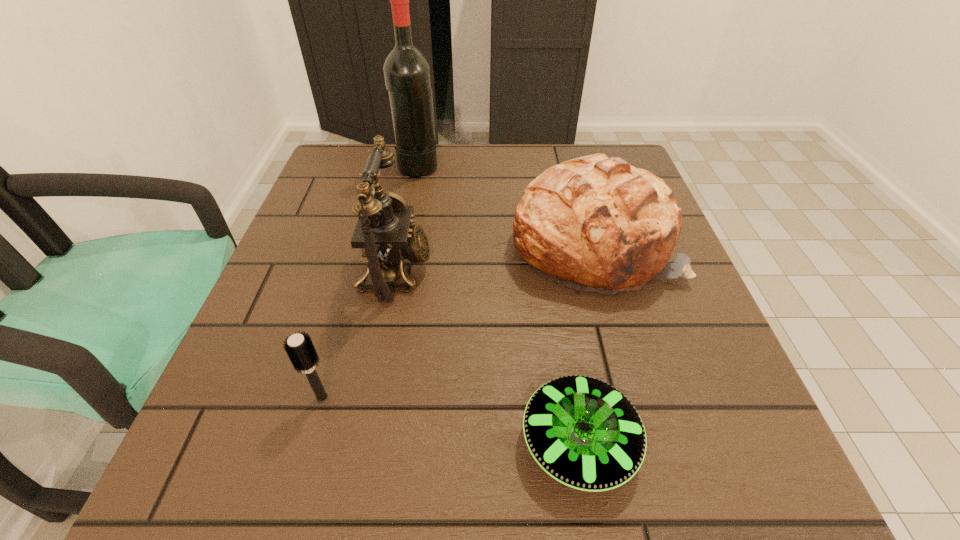
I want to click on wine bottle, so click(407, 74).

Locate an element on the screen. The height and width of the screenshot is (540, 960). the tallest object is located at coordinates (407, 74).

You are a GUI agent. You are given a task and a screenshot of the screen. Output one action in this format:
    pyautogui.click(x=<x>, y=<y>)
    Task: Click on the fourth shortest object
    
    Given the screenshot: What is the action you would take?
    pyautogui.click(x=383, y=231)

Identify the location of bread. (593, 223).

Find the location of a particular element. This screenshot has width=960, height=540. the second shortest object is located at coordinates (300, 349).

Where is `the shortest object`? This screenshot has width=960, height=540. the shortest object is located at coordinates (583, 432).

The width and height of the screenshot is (960, 540). Find the location of `vacant space located 0.330m on the front of the farthest object`. vacant space located 0.330m on the front of the farthest object is located at coordinates (398, 272).

Where is `vacant space located 0.150m on the rotary dial of the telephone`? This screenshot has width=960, height=540. vacant space located 0.150m on the rotary dial of the telephone is located at coordinates (508, 271).

At what (x,y) coordinates should I click in order to perform the action: click on free region located on the left of the bread. Please return your answer as a coordinate pair (x, y). The width and height of the screenshot is (960, 540). Looking at the image, I should click on (453, 245).

Where is `vacant space located 0.250m on the back of the second shortest object`? This screenshot has height=540, width=960. vacant space located 0.250m on the back of the second shortest object is located at coordinates (358, 273).